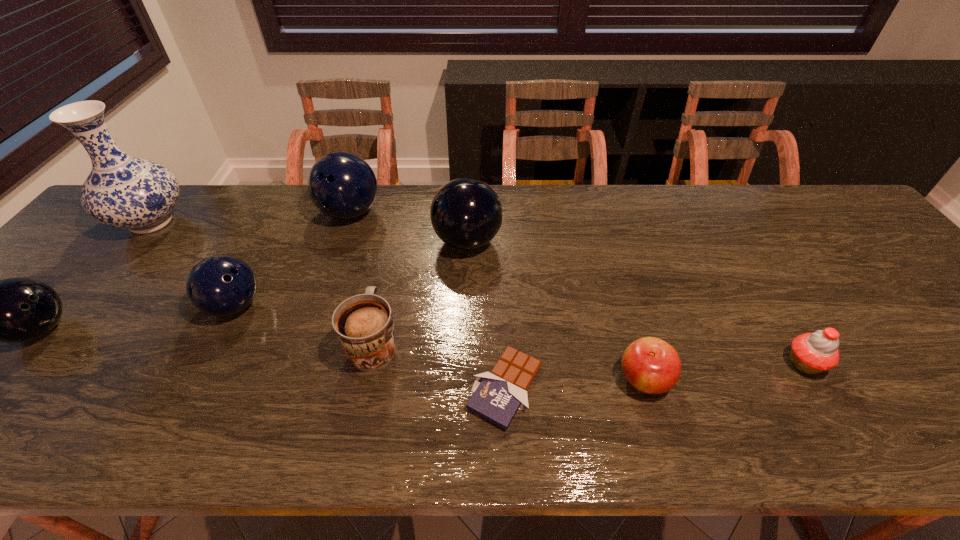
Locate an element on the screen. The width and height of the screenshot is (960, 540). bowling ball that is the closest to the right black bowling ball is located at coordinates pyautogui.click(x=342, y=185).

Identify the location of free space that satisfies the following two spatial constraints: 1. on the back side of the chocolate bar; 2. on the surface of the third bowling ball from right to left near the finger holes. (502, 306).

Locate an element on the screen. Image resolution: width=960 pixels, height=540 pixels. vacant space that satisfies the following two spatial constraints: 1. on the side of the mug with the handle; 2. on the surface of the left blue bowling ball near the finger holes is located at coordinates (382, 306).

Identify the location of vacant space that satisfies the following two spatial constraints: 1. on the surface of the shortest object near the finger holes; 2. on the right side of the second bowling ball from left to right. (194, 388).

Find the location of a particular element. This screenshot has width=960, height=540. vacant space that satisfies the following two spatial constraints: 1. on the surface of the nearer blue bowling ball near the finger holes; 2. on the back side of the cupcake is located at coordinates (205, 363).